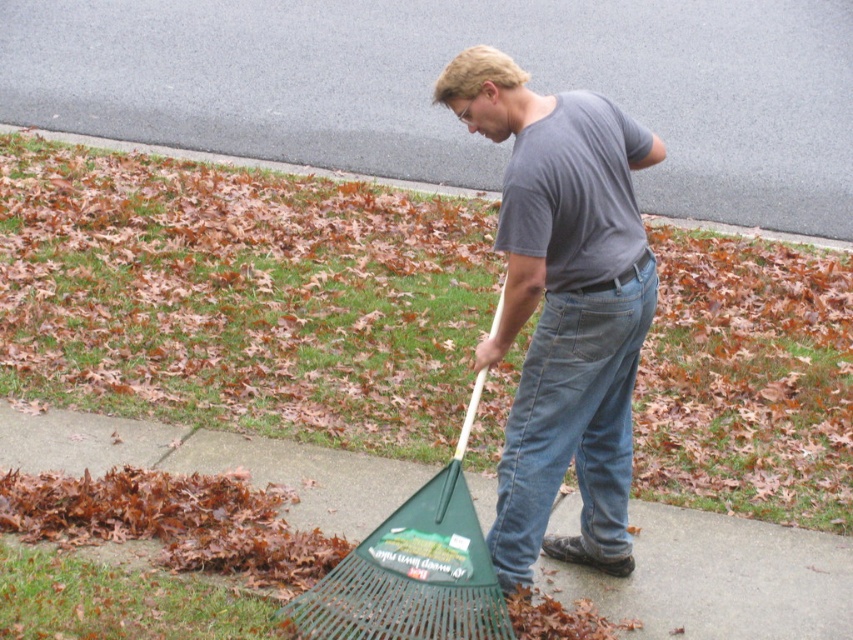
Which is more to the left, gray matte shirt at center or gray cotton shirt at center?

gray matte shirt at center is more to the left.

Can you confirm if gray matte shirt at center is positioned to the right of gray cotton shirt at center?

In fact, gray matte shirt at center is to the left of gray cotton shirt at center.

Is point (289, 29) closer to camera compared to point (485, 120)?

No, it is behind (485, 120).

Find the location of a particular element. The height and width of the screenshot is (640, 853). gray matte shirt at center is located at coordinates (439, 70).

Does green plastic rake at lower center have a smaller size compared to green grass at lower center?

No.

Who is positioned more to the left, green plastic rake at lower center or green grass at lower center?

From the viewer's perspective, green grass at lower center appears more on the left side.

Is point (405, 540) in front of point (740, 227)?

That is True.

You are a GUI agent. You are given a task and a screenshot of the screen. Output one action in this format:
    pyautogui.click(x=<x>, y=<y>)
    Task: Click on the green plastic rake at lower center
    The height and width of the screenshot is (640, 853).
    Given the screenshot: What is the action you would take?
    pyautogui.click(x=413, y=570)

Between jeans at center and green grass at lower center, which one appears on the right side from the viewer's perspective?

Positioned to the right is jeans at center.

This screenshot has height=640, width=853. In order to click on jeans at center in this screenshot , I will do `click(573, 428)`.